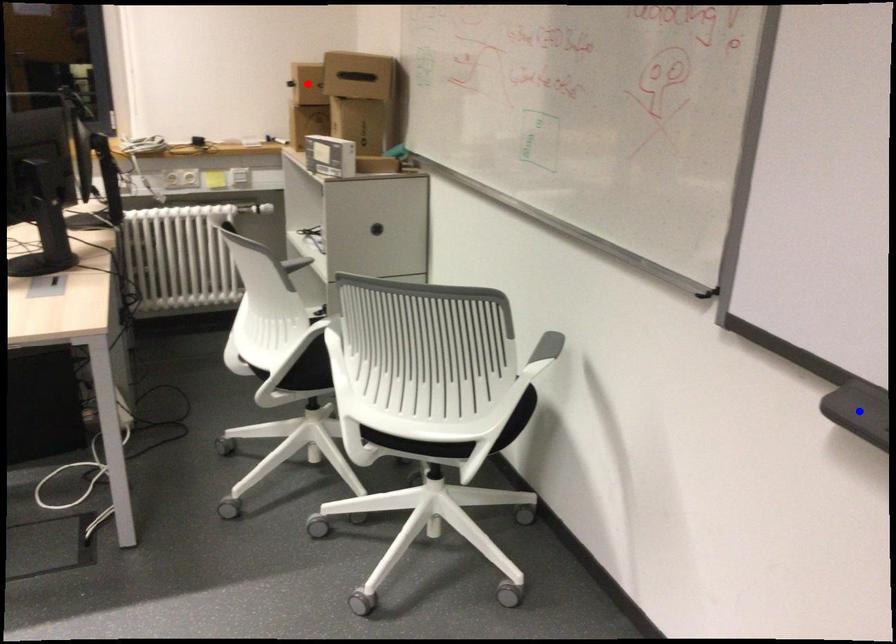
Question: Which of the two points in the image is closer to the camera?

Choices:
 (A) Blue point is closer.
 (B) Red point is closer.

Answer: (A)